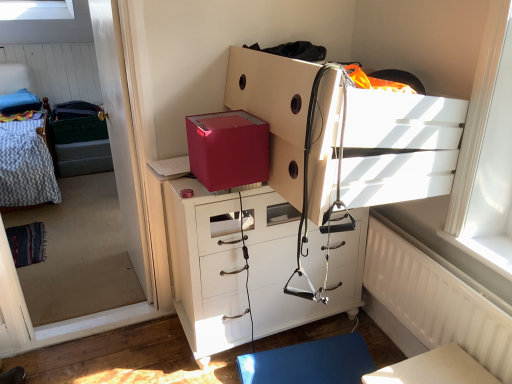
Question: Can you confirm if white glossy chest of drawers at center, placed as the first chest of drawers when sorted from bottom to top, is taller than matte white chest of drawers at center, positioned as the first chest of drawers in top-to-bottom order?

Choices:
 (A) yes
 (B) no

Answer: (A)

Question: Is white glossy chest of drawers at center, positioned as the second chest of drawers in top-to-bottom order, bigger than matte white chest of drawers at center, which is the 2th chest of drawers from bottom to top?

Choices:
 (A) yes
 (B) no

Answer: (A)

Question: Is matte white chest of drawers at center, which is the 2th chest of drawers from bottom to top, surrounded by white glossy chest of drawers at center, positioned as the second chest of drawers in top-to-bottom order?

Choices:
 (A) yes
 (B) no

Answer: (B)

Question: From the image's perspective, does white glossy chest of drawers at center, placed as the first chest of drawers when sorted from bottom to top, appear higher than matte white chest of drawers at center, which is the 2th chest of drawers from bottom to top?

Choices:
 (A) no
 (B) yes

Answer: (A)

Question: From the image's perspective, would you say white glossy chest of drawers at center, placed as the first chest of drawers when sorted from bottom to top, is shown under matte white chest of drawers at center, which is the 2th chest of drawers from bottom to top?

Choices:
 (A) no
 (B) yes

Answer: (B)

Question: From the image's perspective, is white textured radiator at lower right positioned above or below transparent glass window screen at left?

Choices:
 (A) above
 (B) below

Answer: (B)

Question: From their relative heights in the image, would you say white textured radiator at lower right is taller or shorter than transparent glass window screen at left?

Choices:
 (A) short
 (B) tall

Answer: (A)

Question: Visually, is white textured radiator at lower right positioned to the left or to the right of transparent glass window screen at left?

Choices:
 (A) left
 (B) right

Answer: (B)

Question: From a real-world perspective, is white textured radiator at lower right physically located above or below transparent glass window screen at left?

Choices:
 (A) below
 (B) above

Answer: (A)

Question: Do you think white glossy table at lower right is within transparent glass window screen at left, or outside of it?

Choices:
 (A) inside
 (B) outside

Answer: (B)

Question: Is white glossy table at lower right to the left or to the right of transparent glass window screen at left in the image?

Choices:
 (A) right
 (B) left

Answer: (A)

Question: Is point (458, 365) positioned closer to the camera than point (96, 188)?

Choices:
 (A) farther
 (B) closer

Answer: (B)

Question: From the image's perspective, is white glossy table at lower right located above or below transparent glass window screen at left?

Choices:
 (A) above
 (B) below

Answer: (B)

Question: Is blue rubber yoga mat at lower center to the left or to the right of white glossy table at lower right in the image?

Choices:
 (A) left
 (B) right

Answer: (A)

Question: From the image's perspective, is blue rubber yoga mat at lower center located above or below white glossy table at lower right?

Choices:
 (A) above
 (B) below

Answer: (B)